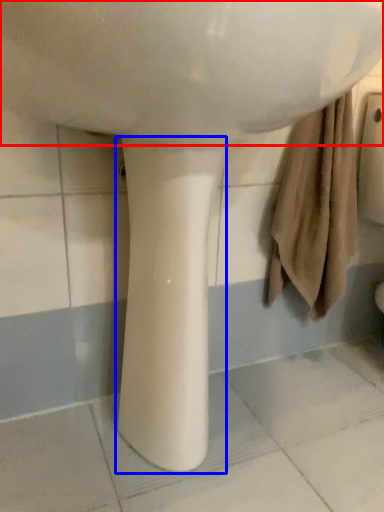
Question: Among these objects, which one is farthest to the camera, sink (highlighted by a red box) or pillar (highlighted by a blue box)?

Choices:
 (A) sink
 (B) pillar

Answer: (B)